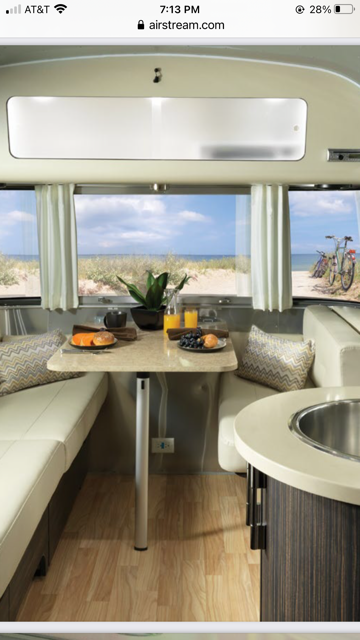
Find the location of `pillow`. pillow is located at coordinates (286, 361).